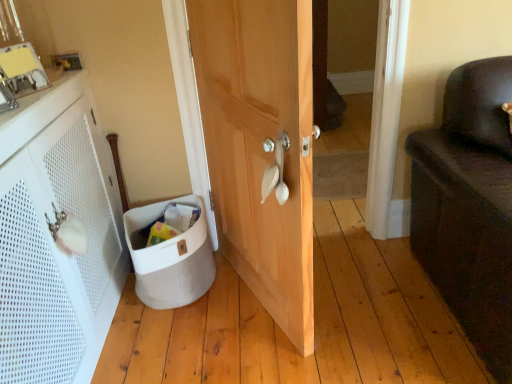
What is the approximate height of natural wood door at center?

The height of natural wood door at center is 4.04 feet.

Locate an element on the screen. Image resolution: width=512 pixels, height=384 pixels. white fabric laundry basket at lower left is located at coordinates (170, 258).

At what (x,y) coordinates should I click in order to perform the action: click on white perforated cabinet at left. Please return your answer as a coordinate pair (x, y). Image resolution: width=512 pixels, height=384 pixels. Looking at the image, I should click on (54, 240).

Considering the relative sizes of white plastic door handle at center and natural wood door at center in the image provided, is white plastic door handle at center thinner than natural wood door at center?

Yes, white plastic door handle at center is thinner than natural wood door at center.

Based on the photo, considering the relative sizes of white plastic door handle at center and natural wood door at center in the image provided, is white plastic door handle at center smaller than natural wood door at center?

Yes.

Is white plastic door handle at center behind natural wood door at center?

Yes, white plastic door handle at center is further from the viewer.

Could you tell me if white plastic door handle at center is turned towards natural wood door at center?

Yes, white plastic door handle at center is oriented towards natural wood door at center.

From a real-world perspective, which object rests below the other?

In real-world perspective, white perforated cabinet at left is lower.

Is white plastic door handle at center in contact with white perforated cabinet at left?

No, white plastic door handle at center is not making contact with white perforated cabinet at left.

This screenshot has height=384, width=512. In order to click on cabinetry in front of the white plastic door handle at center in this screenshot , I will do `click(54, 240)`.

Is white plastic door handle at center smaller than white perforated cabinet at left?

Yes.

Is white plastic door handle at center inside the boundaries of white fabric laundry basket at lower left, or outside?

white plastic door handle at center is not enclosed by white fabric laundry basket at lower left.

Looking at this image, based on their positions, is white plastic door handle at center located to the left or right of white fabric laundry basket at lower left?

From the image, it's evident that white plastic door handle at center is to the right of white fabric laundry basket at lower left.

Based on the photo, considering the sizes of white plastic door handle at center and white fabric laundry basket at lower left in the image, is white plastic door handle at center wider or thinner than white fabric laundry basket at lower left?

white plastic door handle at center is thinner than white fabric laundry basket at lower left.

Is white plastic door handle at center bigger than white fabric laundry basket at lower left?

Incorrect, white plastic door handle at center is not larger than white fabric laundry basket at lower left.

Does natural wood door at center lie behind white plastic door handle at center?

No, natural wood door at center is in front of white plastic door handle at center.

Is natural wood door at center spatially inside white plastic door handle at center, or outside of it?

The correct answer is: outside.

From the image's perspective, which is above, natural wood door at center or white plastic door handle at center?

From the image's view, natural wood door at center is above.

Could you tell me if natural wood door at center is turned towards white plastic door handle at center?

Yes, natural wood door at center is turned towards white plastic door handle at center.

Considering the positions of point (139, 208) and point (272, 273), is point (139, 208) closer or farther from the camera than point (272, 273)?

Point (139, 208) is farther from the camera than point (272, 273).

From the image's perspective, which object appears higher, white fabric laundry basket at lower left or natural wood door at center?

natural wood door at center is shown above in the image.

From a real-world perspective, is white fabric laundry basket at lower left physically below natural wood door at center?

Yes, from a real-world perspective, white fabric laundry basket at lower left is beneath natural wood door at center.

How many degrees apart are the facing directions of white fabric laundry basket at lower left and natural wood door at center?

The angular difference between white fabric laundry basket at lower left and natural wood door at center is 89.4 degrees.

Is natural wood door at center next to white fabric laundry basket at lower left?

No.

Looking at this image, what's the angular difference between natural wood door at center and white fabric laundry basket at lower left's facing directions?

They differ by 89.4 degrees in their facing directions.

Is natural wood door at center to the right of white fabric laundry basket at lower left from the viewer's perspective?

Yes.

Between natural wood door at center and white fabric laundry basket at lower left, which one has smaller size?

Smaller between the two is white fabric laundry basket at lower left.

From the image's perspective, does white perforated cabinet at left appear higher than white plastic door handle at center?

No, from the image's perspective, white perforated cabinet at left is not above white plastic door handle at center.

Considering the sizes of white perforated cabinet at left and white plastic door handle at center in the image, is white perforated cabinet at left bigger or smaller than white plastic door handle at center?

Clearly, white perforated cabinet at left is larger in size than white plastic door handle at center.

Which is more to the right, white perforated cabinet at left or white plastic door handle at center?

white plastic door handle at center.

Where is `door handle behind the natural wood door at center`? door handle behind the natural wood door at center is located at coordinates (275, 169).

This screenshot has width=512, height=384. I want to click on cabinetry that appears on the left of white plastic door handle at center, so click(54, 240).

Considering their positions, is white plastic door handle at center positioned further to white perforated cabinet at left than white fabric laundry basket at lower left?

Among the two, white plastic door handle at center is located further to white perforated cabinet at left.

From the image, which object appears to be farther from white perforated cabinet at left, white plastic door handle at center or natural wood door at center?

white plastic door handle at center is positioned further to the anchor white perforated cabinet at left.

From the image, which object appears to be farther from white fabric laundry basket at lower left, natural wood door at center or white perforated cabinet at left?

natural wood door at center.

When comparing their distances from white plastic door handle at center, does white fabric laundry basket at lower left or white perforated cabinet at left seem closer?

Among the two, white fabric laundry basket at lower left is located nearer to white plastic door handle at center.

Estimate the real-world distances between objects in this image. Which object is further from white plastic door handle at center, white fabric laundry basket at lower left or natural wood door at center?

white fabric laundry basket at lower left is positioned further to the anchor white plastic door handle at center.

Considering their positions, is natural wood door at center positioned further to white plastic door handle at center than white perforated cabinet at left?

white perforated cabinet at left.

Based on their spatial positions, is white perforated cabinet at left or white plastic door handle at center further from white fabric laundry basket at lower left?

white plastic door handle at center is positioned further to the anchor white fabric laundry basket at lower left.

From the image, which object appears to be farther from white plastic door handle at center, white perforated cabinet at left or white fabric laundry basket at lower left?

white perforated cabinet at left is positioned further to the anchor white plastic door handle at center.

The width and height of the screenshot is (512, 384). Find the location of `door between white perforated cabinet at left and white plastic door handle at center in the horizontal direction`. door between white perforated cabinet at left and white plastic door handle at center in the horizontal direction is located at coordinates (260, 145).

Where is `door handle between natural wood door at center and white fabric laundry basket at lower left along the z-axis`? This screenshot has width=512, height=384. door handle between natural wood door at center and white fabric laundry basket at lower left along the z-axis is located at coordinates (275, 169).

Where is `door located between white perforated cabinet at left and white fabric laundry basket at lower left in the depth direction`? This screenshot has width=512, height=384. door located between white perforated cabinet at left and white fabric laundry basket at lower left in the depth direction is located at coordinates (260, 145).

Image resolution: width=512 pixels, height=384 pixels. I want to click on door handle between white perforated cabinet at left and white fabric laundry basket at lower left in the front-back direction, so click(275, 169).